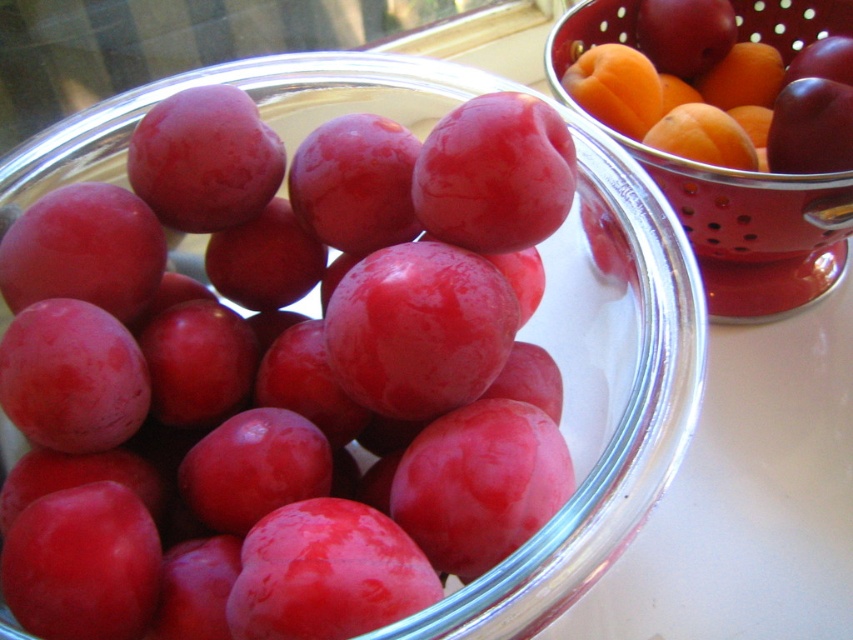
You are arranging fruits in a display and need to stack the glossy red plum at upper right and the orange matte at upper right. Which fruit should you place at the bottom to ensure stability?

The glossy red plum at upper right is taller than the orange matte at upper right, so placing the taller glossy red plum at upper right at the bottom would provide better stability for the stack.

You are arranging fruits in a display and need to place a small decorative item between the glossy red plum at upper right and the orange matte at upper right. The item is 8 centimeters long. Will it fit between them without overlapping?

The distance between the glossy red plum at upper right and the orange matte at upper right is 8.45 centimeters. Since the item is 8 centimeters long, it will fit between them without overlapping as there is enough space.

You are organizing fruits in the kitchen. You have a glossy red plum at upper right and an orange matte at upper right. Which fruit is bigger?

The glossy red plum at upper right is larger in size compared to the orange matte at upper right.